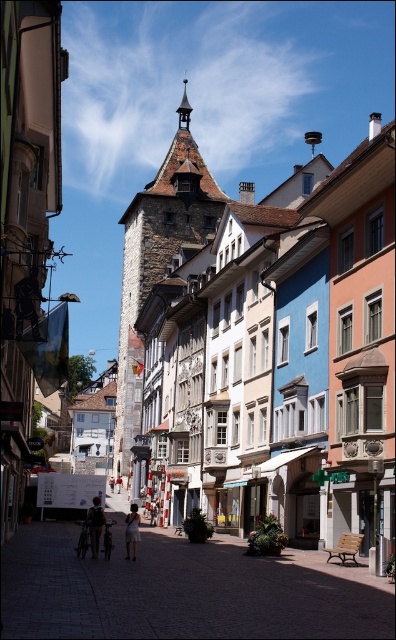
You are a tourist standing on the street and want to take a photo of both the stone tower at center and the white cotton dress at center. Since the camera has a fixed focal length, you need to stand at a position where both objects are in frame. Considering their sizes, which object should you focus on to ensure both are fully visible?

The stone tower at center is wider than the white cotton dress at center, so you should focus on the stone tower at center to ensure both are fully visible.

You are a tourist standing on the street looking at the historic tower and the colorful buildings. You notice two people wearing dark blue jeans at center and white cotton dress at center. Which person is closer to you?

The dark blue jeans at center is closer to you because it is further to the viewer than the white cotton dress at center.